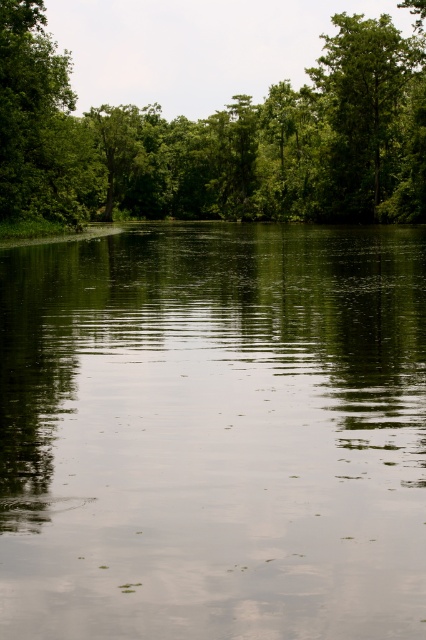
Does green leafy forest at center lie behind green leafy tree at upper right?

No, it is in front of green leafy tree at upper right.

Does point (117, 141) come closer to viewer compared to point (411, 145)?

No, it is not.

Locate an element on the screen. The height and width of the screenshot is (640, 426). green leafy forest at center is located at coordinates (219, 138).

Is the position of green reflective water at center more distant than that of green leafy tree at upper right?

No.

Who is lower down, green reflective water at center or green leafy tree at upper right?

green reflective water at center is below.

Image resolution: width=426 pixels, height=640 pixels. Identify the location of green reflective water at center. (213, 433).

Is green reflective water at center above green leafy forest at center?

Incorrect, green reflective water at center is not positioned above green leafy forest at center.

Does green reflective water at center have a lesser height compared to green leafy forest at center?

Correct, green reflective water at center is not as tall as green leafy forest at center.

Image resolution: width=426 pixels, height=640 pixels. Identify the location of green reflective water at center. (213, 433).

At what (x,y) coordinates should I click in order to perform the action: click on green reflective water at center. Please return your answer as a coordinate pair (x, y). The image size is (426, 640). Looking at the image, I should click on [x=213, y=433].